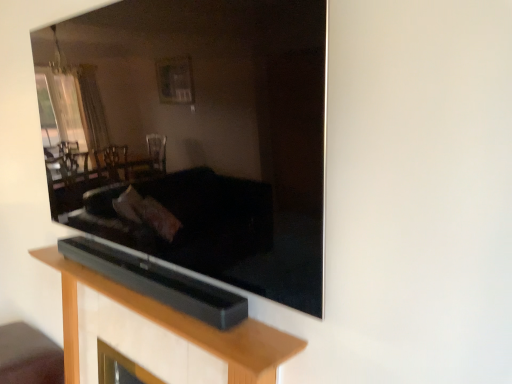
Describe the element at coordinates (173, 327) in the screenshot. The height and width of the screenshot is (384, 512). I see `black matte soundbar at center` at that location.

Find the location of a particular element. black matte soundbar at center is located at coordinates (173, 327).

Image resolution: width=512 pixels, height=384 pixels. Find the location of `black matte soundbar at center`. black matte soundbar at center is located at coordinates (173, 327).